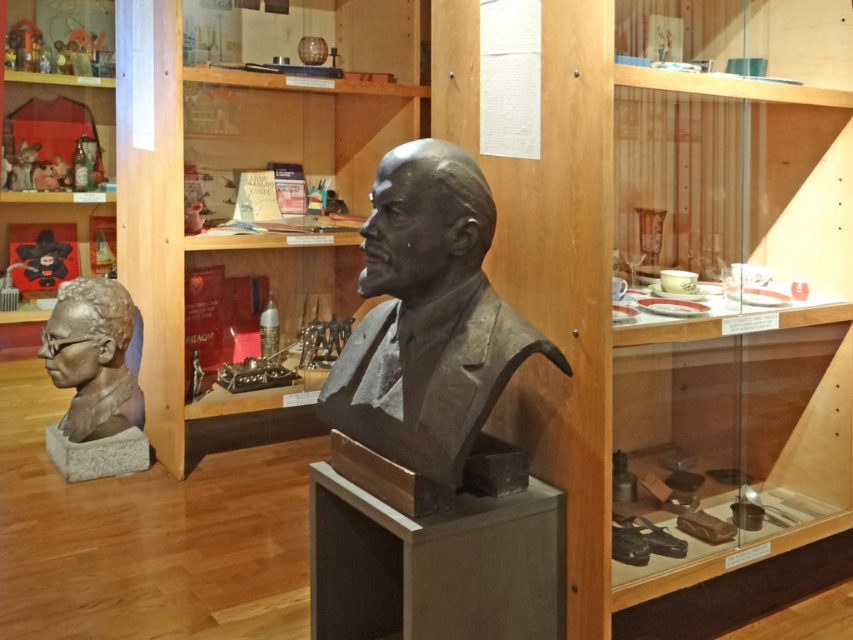
Who is more forward, (258, 275) or (114, 340)?

Positioned in front is point (114, 340).

Is wooden bookshelf at center taller than satin silver bust at center?

Yes, wooden bookshelf at center is taller than satin silver bust at center.

Identify the location of wooden bookshelf at center. (258, 168).

Which is behind, point (177, 365) or point (412, 161)?

Point (177, 365)

Can you confirm if wooden bookshelf at center is thinner than slate gray stone bust at center?

Incorrect, wooden bookshelf at center's width is not less than slate gray stone bust at center's.

Locate an element on the screen. The image size is (853, 640). wooden bookshelf at center is located at coordinates (258, 168).

Which is more to the left, slate gray stone bust at center or satin silver bust at center?

satin silver bust at center

Is slate gray stone bust at center bigger than satin silver bust at center?

Yes, slate gray stone bust at center is bigger than satin silver bust at center.

Is point (392, 252) closer to viewer compared to point (56, 328)?

Yes, it is.

Find the location of a particular element. The height and width of the screenshot is (640, 853). slate gray stone bust at center is located at coordinates (427, 317).